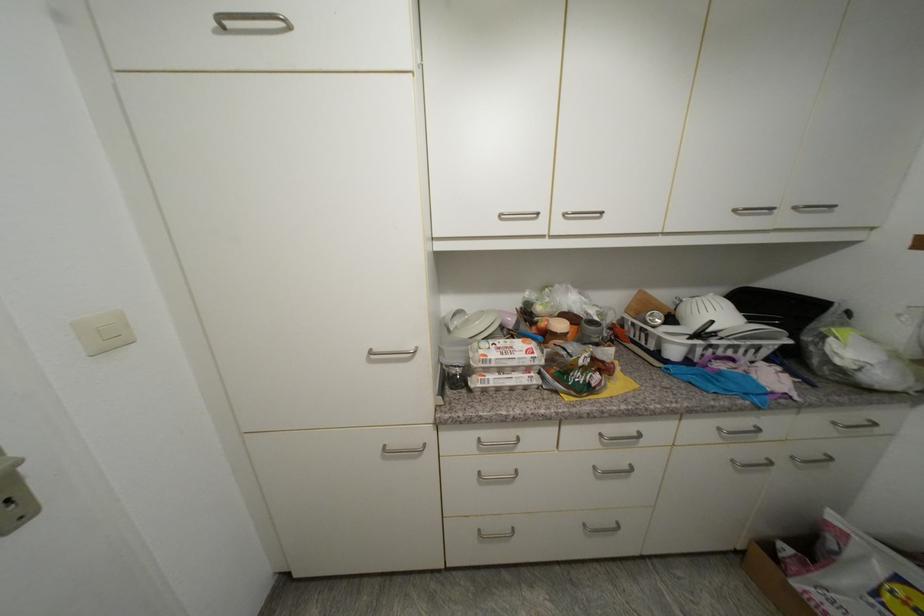
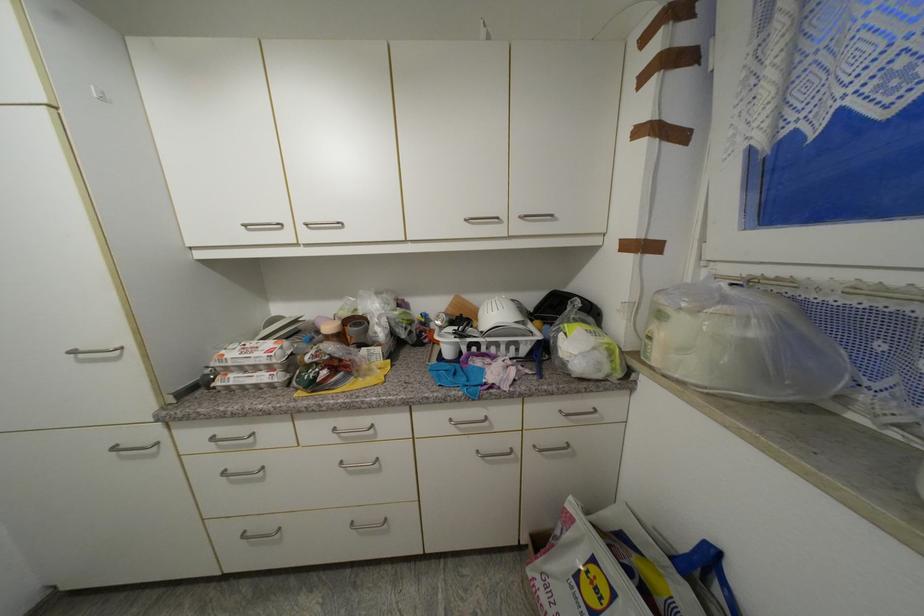
Question: The images are taken continuously from a first-person perspective. In which direction is your viewpoint rotating?

Choices:
 (A) Left
 (B) Right
 (C) Up
 (D) Down

Answer: (C)